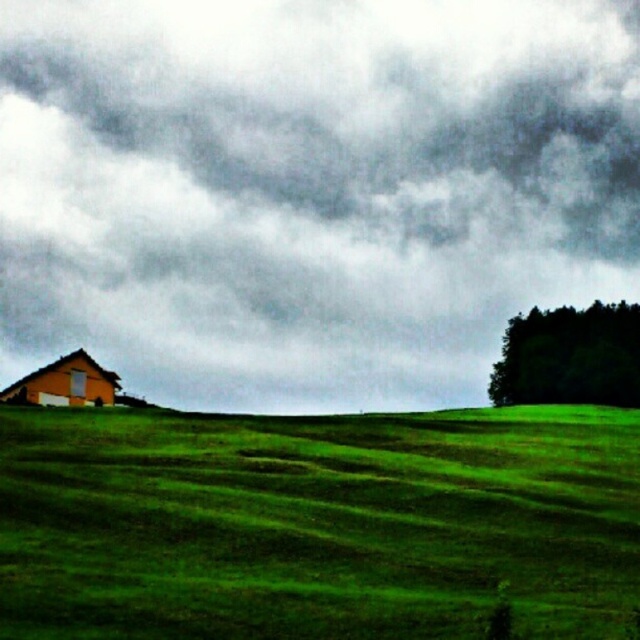
Question: Which object is farther from the camera taking this photo?

Choices:
 (A) green grassy hillside at lower left
 (B) dark gray cloud at upper center
 (C) orange matte hut at left
 (D) dark green textured trees at right

Answer: (B)

Question: Among these objects, which one is nearest to the camera?

Choices:
 (A) dark green textured trees at right
 (B) orange matte hut at left
 (C) dark gray cloud at upper center

Answer: (B)

Question: Is dark green textured trees at right above orange matte hut at left?

Choices:
 (A) yes
 (B) no

Answer: (A)

Question: Does dark gray cloud at upper center appear on the left side of orange matte hut at left?

Choices:
 (A) no
 (B) yes

Answer: (A)

Question: Does dark gray cloud at upper center appear over orange matte hut at left?

Choices:
 (A) no
 (B) yes

Answer: (B)

Question: Which of these objects is positioned closest to the dark gray cloud at upper center?

Choices:
 (A) green grassy hillside at lower left
 (B) dark green textured trees at right

Answer: (B)